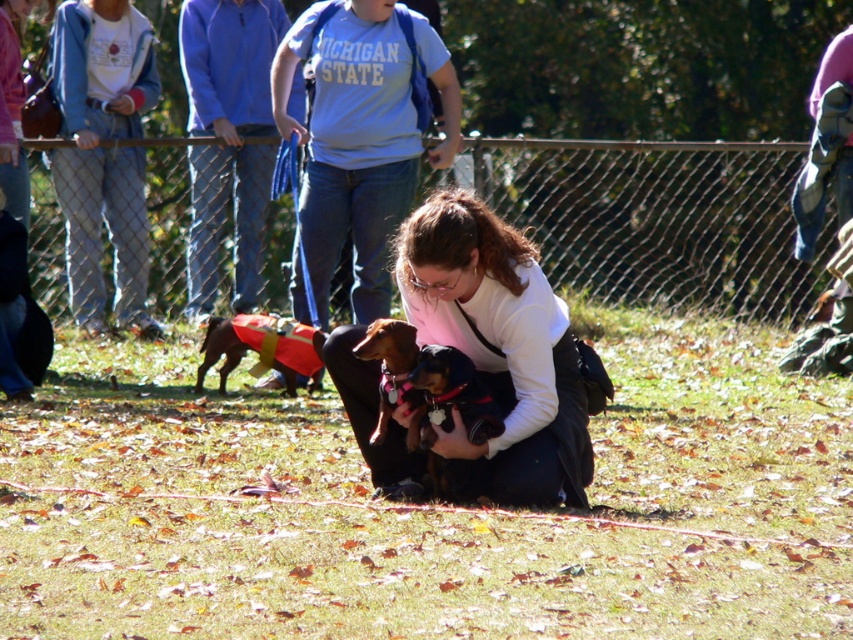
Question: Can you confirm if velvety black dog at center is positioned above brown fur dog at center?

Choices:
 (A) yes
 (B) no

Answer: (B)

Question: Which point appears farthest from the camera in this image?

Choices:
 (A) (421, 364)
 (B) (410, 422)
 (C) (305, 364)
 (D) (469, 298)

Answer: (C)

Question: Can you confirm if brown leather dog at center is wider than brown fur dog at center?

Choices:
 (A) yes
 (B) no

Answer: (A)

Question: Which of the following is the farthest from the observer?

Choices:
 (A) (438, 412)
 (B) (431, 314)

Answer: (B)

Question: Which object appears farthest from the camera in this image?

Choices:
 (A) white matte shirt at center
 (B) brown leather dog at center

Answer: (B)

Question: Where is brown leather dog at center located in relation to brown fur dog at center in the image?

Choices:
 (A) left
 (B) right

Answer: (A)